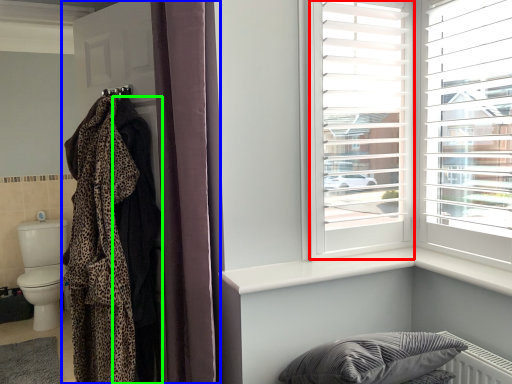
Question: Estimate the real-world distances between objects in this image. Which object is farther from window frame (highlighted by a red box), closet (highlighted by a blue box) or robe (highlighted by a green box)?

Choices:
 (A) closet
 (B) robe

Answer: (B)